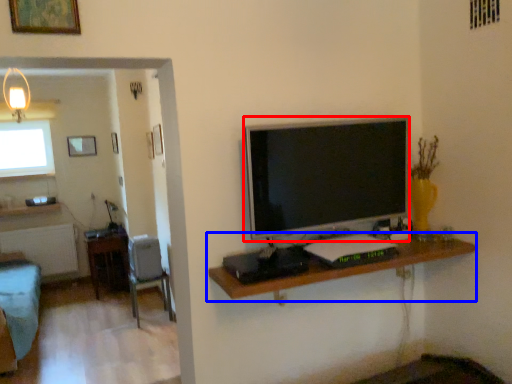
Question: Which object appears closest to the camera in this image, television (highlighted by a red box) or shelf (highlighted by a blue box)?

Choices:
 (A) television
 (B) shelf

Answer: (B)